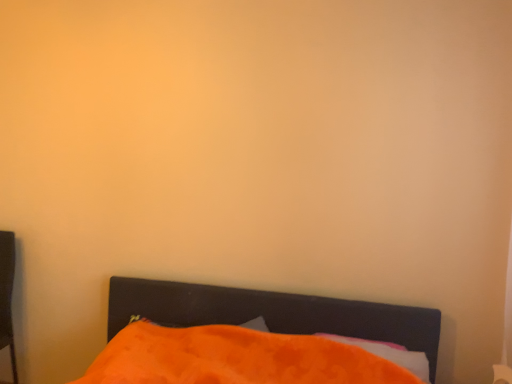
Question: Considering the relative sizes of orange fabric pillow at lower center and orange fabric bed at lower center in the image provided, is orange fabric pillow at lower center bigger than orange fabric bed at lower center?

Choices:
 (A) yes
 (B) no

Answer: (B)

Question: From the image's perspective, is orange fabric pillow at lower center beneath orange fabric bed at lower center?

Choices:
 (A) no
 (B) yes

Answer: (A)

Question: From a real-world perspective, is orange fabric pillow at lower center over orange fabric bed at lower center?

Choices:
 (A) yes
 (B) no

Answer: (A)

Question: Considering the relative sizes of orange fabric pillow at lower center and orange fabric bed at lower center in the image provided, is orange fabric pillow at lower center taller than orange fabric bed at lower center?

Choices:
 (A) yes
 (B) no

Answer: (B)

Question: Does orange fabric pillow at lower center have a greater width compared to orange fabric bed at lower center?

Choices:
 (A) yes
 (B) no

Answer: (B)

Question: Is orange fabric pillow at lower center in contact with orange fabric bed at lower center?

Choices:
 (A) yes
 (B) no

Answer: (B)

Question: From the image's perspective, is orange fabric bed at lower center on orange fabric pillow at lower center?

Choices:
 (A) no
 (B) yes

Answer: (A)

Question: Considering the relative positions of orange fabric bed at lower center and orange fabric pillow at lower center in the image provided, is orange fabric bed at lower center in front of orange fabric pillow at lower center?

Choices:
 (A) yes
 (B) no

Answer: (A)

Question: Is the surface of orange fabric bed at lower center in direct contact with orange fabric pillow at lower center?

Choices:
 (A) no
 (B) yes

Answer: (A)

Question: Is orange fabric bed at lower center not close to orange fabric pillow at lower center?

Choices:
 (A) yes
 (B) no

Answer: (B)

Question: Is orange fabric bed at lower center at the left side of orange fabric pillow at lower center?

Choices:
 (A) yes
 (B) no

Answer: (A)

Question: From a real-world perspective, does orange fabric bed at lower center sit lower than orange fabric pillow at lower center?

Choices:
 (A) no
 (B) yes

Answer: (B)

Question: Do you think orange fabric pillow at lower center is within orange fabric bed at lower center, or outside of it?

Choices:
 (A) inside
 (B) outside

Answer: (A)